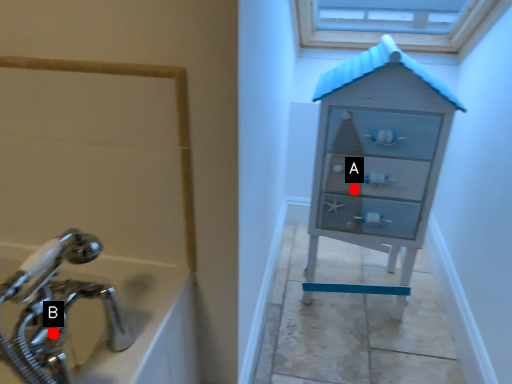
Question: Two points are circled on the image, labeled by A and B beside each circle. Which point is further to the camera?

Choices:
 (A) A is further
 (B) B is further

Answer: (A)